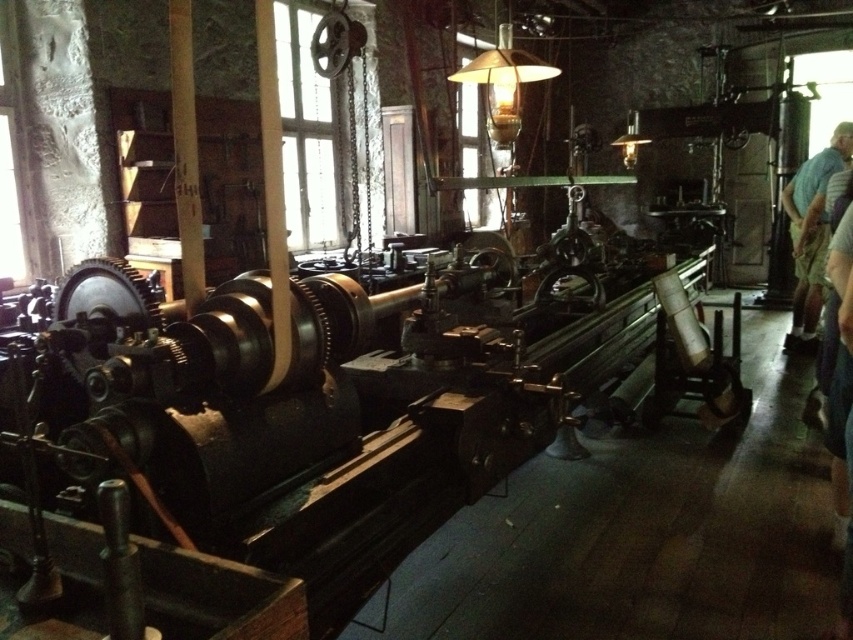
You are an inspector in the workshop and need to check the blue shirt at right and the matte glass lampshade at upper center. According to the scene description, which object is positioned more to the east side of the workshop?

The blue shirt at right is to the right of the matte glass lampshade at upper center, so the blue shirt at right is positioned more to the east side of the workshop.

You are an inspector in the workshop and need to compare the widths of the blue shirt at right and the matte glass lampshade at upper center. Which object is wider?

The blue shirt at right is wider than the matte glass lampshade at upper center according to the description.